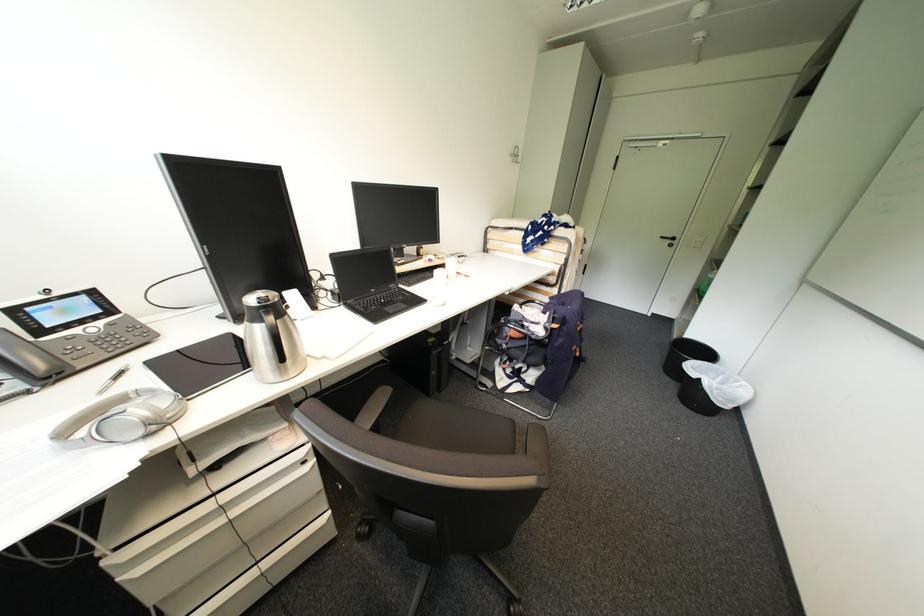
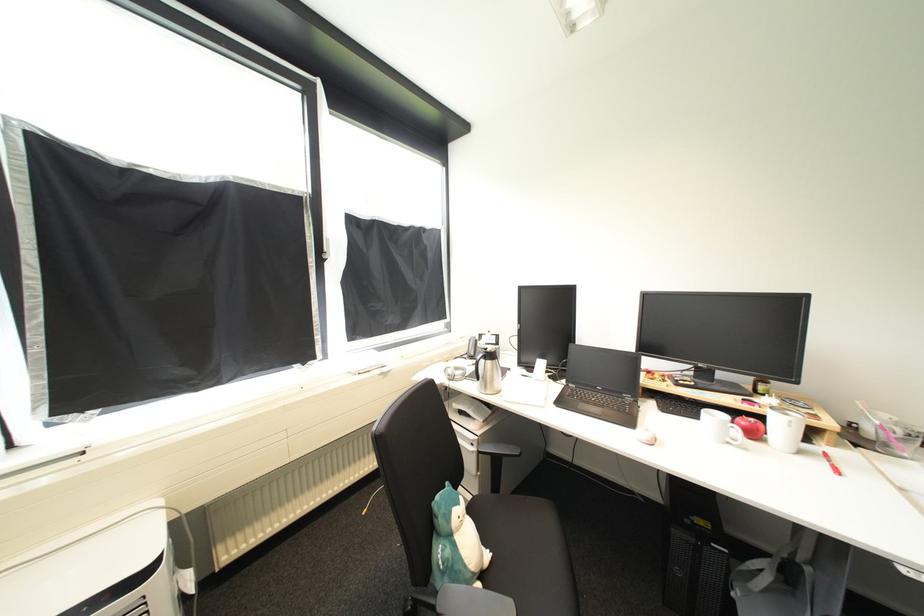
Where in the second image is the point corresponding to (x=454, y=286) from the first image?

(736, 445)